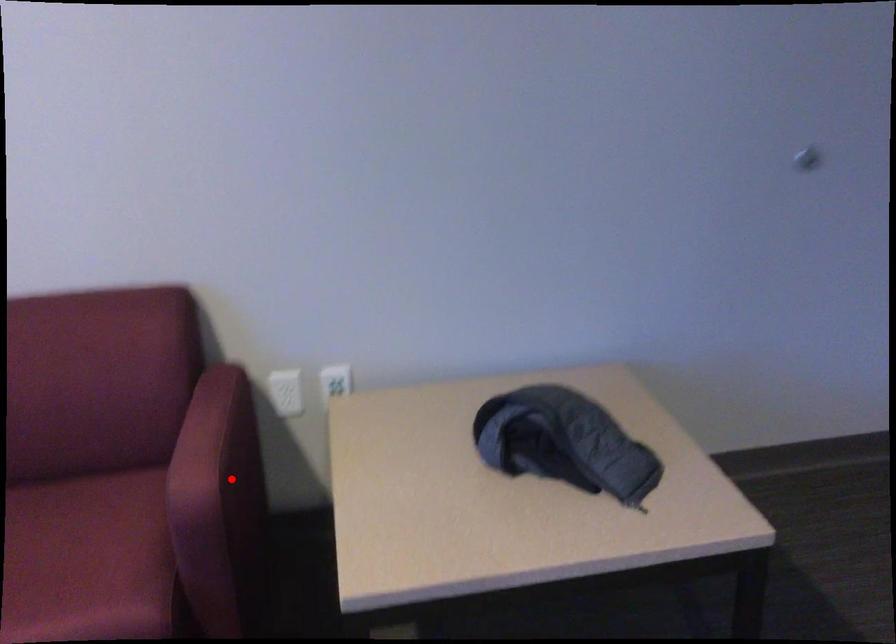
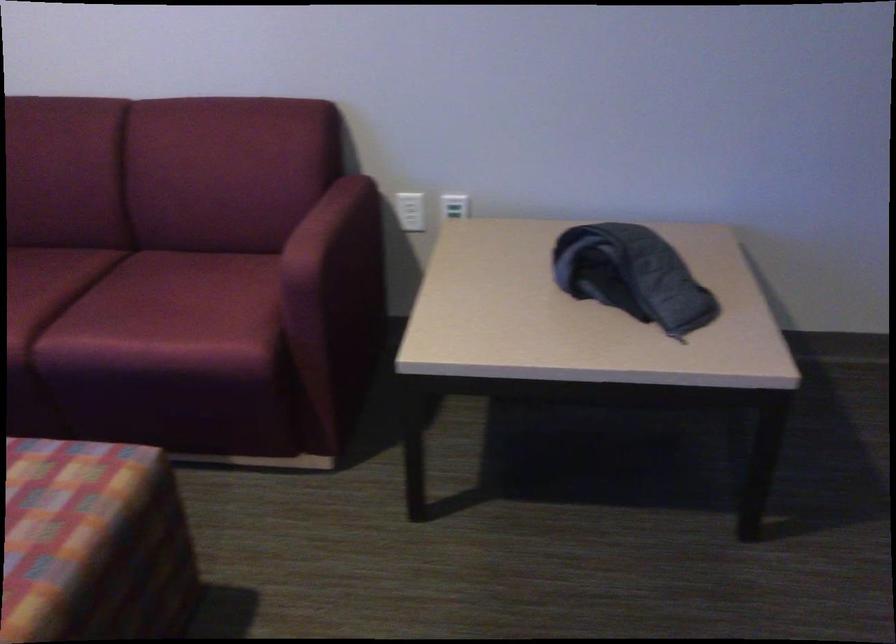
Where in the second image is the point corresponding to the highlighted location from the first image?

(334, 259)